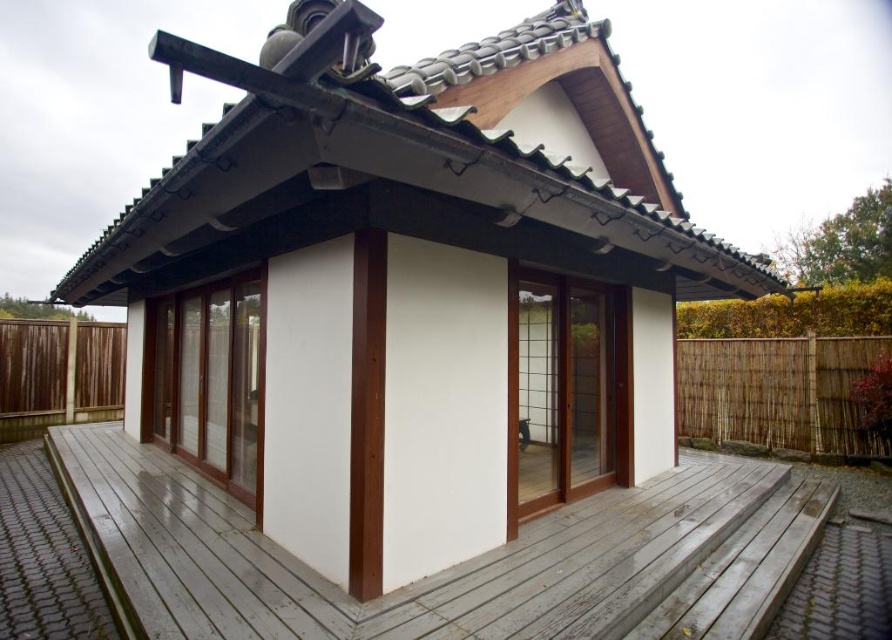
Question: Which object is closer to the camera taking this photo?

Choices:
 (A) shiny black tiles at upper center
 (B) smooth wooden deck at center

Answer: (A)

Question: Is shiny black tiles at upper center further to the viewer compared to smooth wooden deck at center?

Choices:
 (A) yes
 (B) no

Answer: (B)

Question: Among these points, which one is nearest to the camera?

Choices:
 (A) (767, 497)
 (B) (579, 184)

Answer: (B)

Question: Is shiny black tiles at upper center to the right of smooth wooden deck at center from the viewer's perspective?

Choices:
 (A) no
 (B) yes

Answer: (A)

Question: Which point is closer to the camera?

Choices:
 (A) shiny black tiles at upper center
 (B) smooth wooden deck at center

Answer: (A)

Question: Is shiny black tiles at upper center further to the viewer compared to smooth wooden deck at center?

Choices:
 (A) no
 (B) yes

Answer: (A)